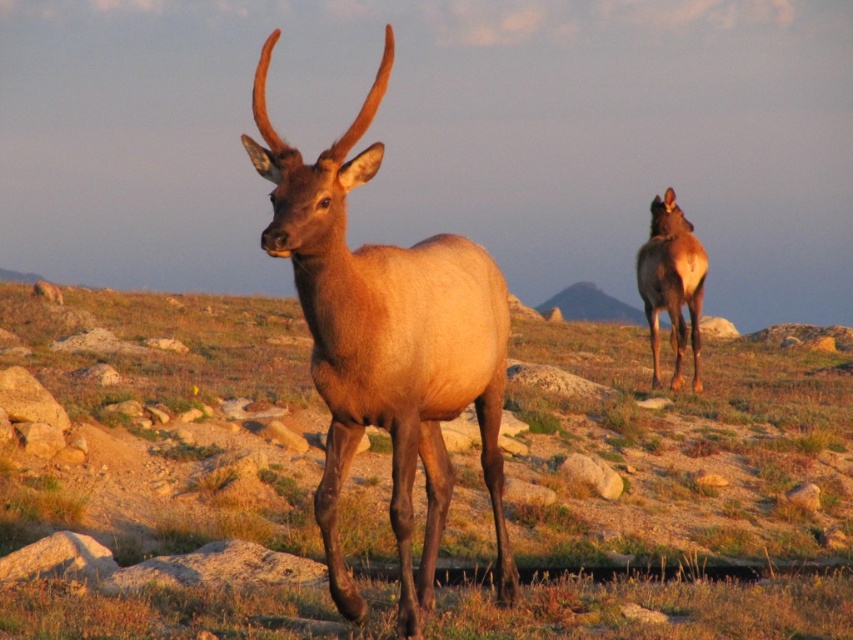
Question: Is brown matte grass at center above brown velvet deer at right?

Choices:
 (A) no
 (B) yes

Answer: (A)

Question: Which of the following is the closest to the observer?

Choices:
 (A) (579, 406)
 (B) (341, 224)
 (C) (668, 310)

Answer: (B)

Question: Is brown matte grass at center thinner than shiny brown deer at center?

Choices:
 (A) yes
 (B) no

Answer: (B)

Question: Where is brown matte grass at center located in relation to brown velvet deer at right in the image?

Choices:
 (A) below
 (B) above

Answer: (A)

Question: Which point is farther to the camera?

Choices:
 (A) brown velvet deer at right
 (B) shiny brown deer at center
 (C) brown matte grass at center

Answer: (A)

Question: Which point is closer to the camera taking this photo?

Choices:
 (A) (173, 595)
 (B) (704, 259)

Answer: (A)